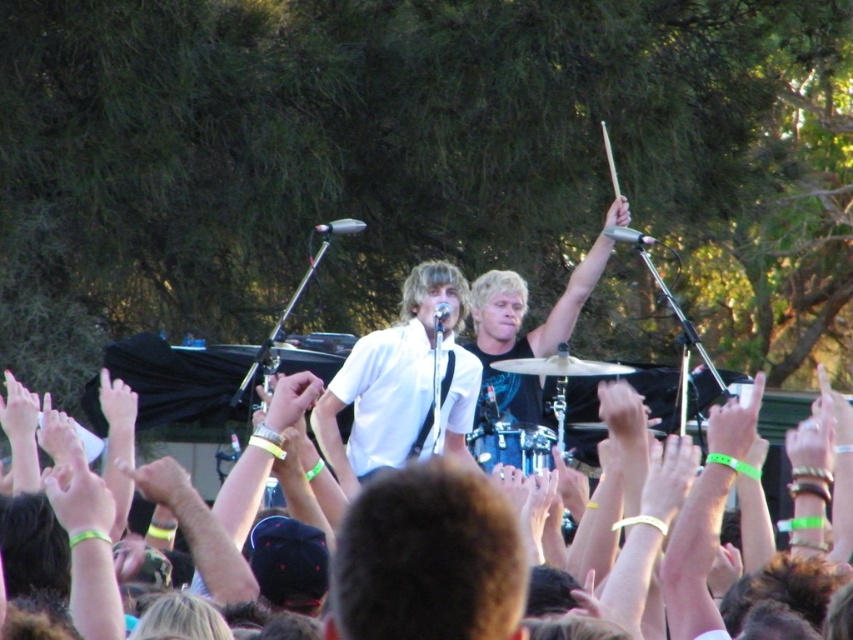
You are at an outdoor concert and notice two hands in the air. One is a light brown leather hand at center and the other is a white matte hand at upper center. Which hand is above the other?

The white matte hand at upper center is above the light brown leather hand at center because the light brown leather hand at center is positioned under it.

You are a photographer at the concert. You want to capture a photo that includes both the white matte hand at center and the light skin tone flesh at raised. Which hand should you zoom in on to ensure both are visible in the frame?

The white matte hand at center is smaller than the light skin tone flesh at raised, so you should zoom in on the light skin tone flesh at raised to ensure both are visible in the frame.